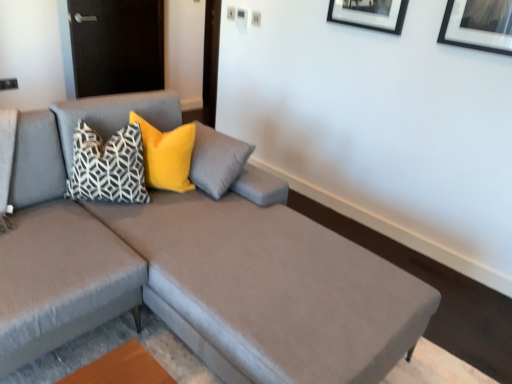
Describe the element at coordinates (106, 166) in the screenshot. I see `geometric-patterned fabric pillow at center, the second pillow in the right-to-left sequence` at that location.

Image resolution: width=512 pixels, height=384 pixels. Find the location of `geometric-patterned fabric pillow at center, the first pillow from the left`. geometric-patterned fabric pillow at center, the first pillow from the left is located at coordinates (106, 166).

In the scene shown: Who is smaller, velvet yellow pillow at upper left, arranged as the first pillow when viewed from the right, or geometric-patterned fabric pillow at center, the first pillow from the left?

Smaller between the two is velvet yellow pillow at upper left, arranged as the first pillow when viewed from the right.

Is velvet yellow pillow at upper left, which is the 2th pillow in left-to-right order, not near geometric-patterned fabric pillow at center, the second pillow in the right-to-left sequence?

They are positioned close to each other.

How distant is velvet yellow pillow at upper left, which is the 2th pillow in left-to-right order, from geometric-patterned fabric pillow at center, the second pillow in the right-to-left sequence?

velvet yellow pillow at upper left, which is the 2th pillow in left-to-right order, and geometric-patterned fabric pillow at center, the second pillow in the right-to-left sequence, are 7.08 inches apart.

Considering the relative sizes of velvet yellow pillow at upper left, which is the 2th pillow in left-to-right order, and geometric-patterned fabric pillow at center, the first pillow from the left, in the image provided, is velvet yellow pillow at upper left, which is the 2th pillow in left-to-right order, wider than geometric-patterned fabric pillow at center, the first pillow from the left,?

No.

Is geometric-patterned fabric pillow at center, the second pillow in the right-to-left sequence, in front of or behind velvet yellow pillow at upper left, arranged as the first pillow when viewed from the right, in the image?

Clearly, geometric-patterned fabric pillow at center, the second pillow in the right-to-left sequence, is in front of velvet yellow pillow at upper left, arranged as the first pillow when viewed from the right.

Would you say geometric-patterned fabric pillow at center, the second pillow in the right-to-left sequence, is outside velvet yellow pillow at upper left, which is the 2th pillow in left-to-right order?

geometric-patterned fabric pillow at center, the second pillow in the right-to-left sequence, lies outside velvet yellow pillow at upper left, which is the 2th pillow in left-to-right order,'s area.

Does point (67, 193) come in front of point (149, 133)?

That is True.

Which object is wider, geometric-patterned fabric pillow at center, the second pillow in the right-to-left sequence, or velvet yellow pillow at upper left, arranged as the first pillow when viewed from the right?

geometric-patterned fabric pillow at center, the second pillow in the right-to-left sequence.

Is there a large distance between geometric-patterned fabric pillow at center, the first pillow from the left, and textured gray couch at center?

No, geometric-patterned fabric pillow at center, the first pillow from the left, is not far from textured gray couch at center.

Identify the location of studio couch in front of the geometric-patterned fabric pillow at center, the second pillow in the right-to-left sequence. This screenshot has width=512, height=384. (194, 266).

Is geometric-patterned fabric pillow at center, the second pillow in the right-to-left sequence, shorter than textured gray couch at center?

Yes, geometric-patterned fabric pillow at center, the second pillow in the right-to-left sequence, is shorter than textured gray couch at center.

Is point (192, 143) positioned behind point (252, 264)?

Yes.

From the image's perspective, between velvet yellow pillow at upper left, arranged as the first pillow when viewed from the right, and textured gray couch at center, which one is located above?

velvet yellow pillow at upper left, arranged as the first pillow when viewed from the right, appears higher in the image.

Between velvet yellow pillow at upper left, which is the 2th pillow in left-to-right order, and textured gray couch at center, which one appears on the left side from the viewer's perspective?

From the viewer's perspective, velvet yellow pillow at upper left, which is the 2th pillow in left-to-right order, appears more on the left side.

Is velvet yellow pillow at upper left, which is the 2th pillow in left-to-right order, shorter than textured gray couch at center?

Indeed, velvet yellow pillow at upper left, which is the 2th pillow in left-to-right order, has a lesser height compared to textured gray couch at center.

From a real-world perspective, is textured gray couch at center physically located above or below geometric-patterned fabric pillow at center, the second pillow in the right-to-left sequence?

Clearly, from a real-world perspective, textured gray couch at center is below geometric-patterned fabric pillow at center, the second pillow in the right-to-left sequence.

In terms of width, does textured gray couch at center look wider or thinner when compared to geometric-patterned fabric pillow at center, the second pillow in the right-to-left sequence?

textured gray couch at center is wider than geometric-patterned fabric pillow at center, the second pillow in the right-to-left sequence.

In the image, is textured gray couch at center positioned in front of or behind geometric-patterned fabric pillow at center, the first pillow from the left?

In the image, textured gray couch at center appears in front of geometric-patterned fabric pillow at center, the first pillow from the left.

Measure the distance between textured gray couch at center and geometric-patterned fabric pillow at center, the first pillow from the left.

They are 15.69 inches apart.

Measure the distance between textured gray couch at center and velvet yellow pillow at upper left, which is the 2th pillow in left-to-right order.

textured gray couch at center and velvet yellow pillow at upper left, which is the 2th pillow in left-to-right order, are 18.54 inches apart from each other.

Is textured gray couch at center turned away from velvet yellow pillow at upper left, arranged as the first pillow when viewed from the right?

Yes.

Which of these two, textured gray couch at center or velvet yellow pillow at upper left, which is the 2th pillow in left-to-right order, is bigger?

Bigger between the two is textured gray couch at center.

Which is behind, textured gray couch at center or velvet yellow pillow at upper left, which is the 2th pillow in left-to-right order?

velvet yellow pillow at upper left, which is the 2th pillow in left-to-right order, is further away from the camera.

Where is `pillow on the left of the velvet yellow pillow at upper left, which is the 2th pillow in left-to-right order`? pillow on the left of the velvet yellow pillow at upper left, which is the 2th pillow in left-to-right order is located at coordinates (106, 166).

Locate an element on the screen. pillow above the geometric-patterned fabric pillow at center, the second pillow in the right-to-left sequence (from the image's perspective) is located at coordinates tap(166, 155).

Based on their spatial positions, is geometric-patterned fabric pillow at center, the first pillow from the left, or velvet yellow pillow at upper left, which is the 2th pillow in left-to-right order, closer to textured gray couch at center?

geometric-patterned fabric pillow at center, the first pillow from the left, is closer to textured gray couch at center.

Considering their positions, is textured gray couch at center positioned further to velvet yellow pillow at upper left, which is the 2th pillow in left-to-right order, than geometric-patterned fabric pillow at center, the first pillow from the left?

textured gray couch at center is positioned further to the anchor velvet yellow pillow at upper left, which is the 2th pillow in left-to-right order.

Which object lies nearer to the anchor point geometric-patterned fabric pillow at center, the first pillow from the left, velvet yellow pillow at upper left, which is the 2th pillow in left-to-right order, or textured gray couch at center?

velvet yellow pillow at upper left, which is the 2th pillow in left-to-right order, is positioned closer to the anchor geometric-patterned fabric pillow at center, the first pillow from the left.

Based on their spatial positions, is velvet yellow pillow at upper left, which is the 2th pillow in left-to-right order, or geometric-patterned fabric pillow at center, the first pillow from the left, further from textured gray couch at center?

Based on the image, velvet yellow pillow at upper left, which is the 2th pillow in left-to-right order, appears to be further to textured gray couch at center.

When comparing their distances from velvet yellow pillow at upper left, arranged as the first pillow when viewed from the right, does geometric-patterned fabric pillow at center, the first pillow from the left, or textured gray couch at center seem further?

Among the two, textured gray couch at center is located further to velvet yellow pillow at upper left, arranged as the first pillow when viewed from the right.

From the image, which object appears to be nearer to geometric-patterned fabric pillow at center, the second pillow in the right-to-left sequence, textured gray couch at center or velvet yellow pillow at upper left, arranged as the first pillow when viewed from the right?

velvet yellow pillow at upper left, arranged as the first pillow when viewed from the right.

In order to click on pillow positioned between textured gray couch at center and velvet yellow pillow at upper left, which is the 2th pillow in left-to-right order, from near to far in this screenshot , I will do `click(106, 166)`.